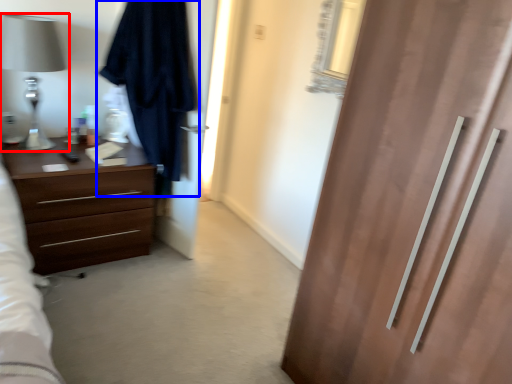
Question: Which of the following is the farthest to the observer, table lamp (highlighted by a red box) or robe (highlighted by a blue box)?

Choices:
 (A) table lamp
 (B) robe

Answer: (A)